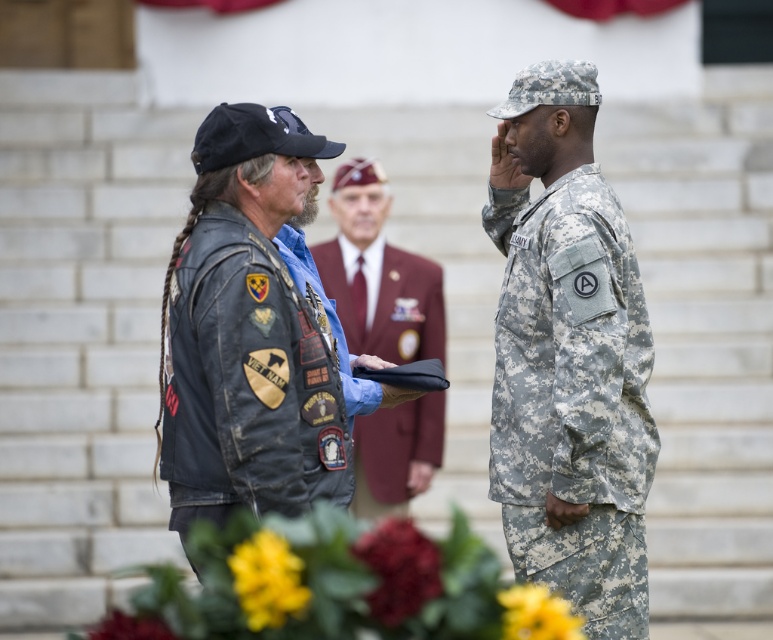
You are attending a formal outdoor event and notice two individuals in the foreground. The first person is wearing a leather jacket at left, and the second is wearing a maroon fabric suit at center. Based on their positions, which individual is closer to you?

The leather jacket at left is closer to you because it is in front of the maroon fabric suit at center.

You are a photographer at this event. You want to take a photo that includes both the leather jacket at left and the camouflage fabric uniform at right. Which person should be positioned closer to the camera to ensure both are in focus?

The camouflage fabric uniform at right should be positioned closer to the camera because the leather jacket at left is behind it. By moving the person in the camouflage fabric uniform at right forward, both individuals will be at a similar distance from the camera, ensuring both are in focus.

You are attending the ceremony and need to locate the veteran in the maroon fabric suit at center. Which direction should you look relative to the camouflage fabric uniform at right?

The camouflage fabric uniform at right is to the right of the maroon fabric suit at center, so you should look to the left of the camouflage fabric uniform at right to find the maroon fabric suit at center.